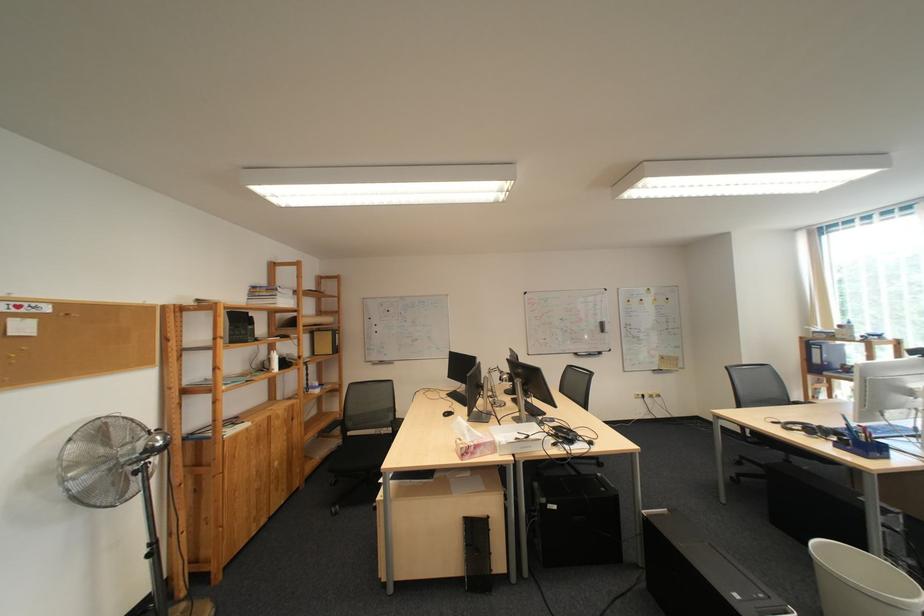
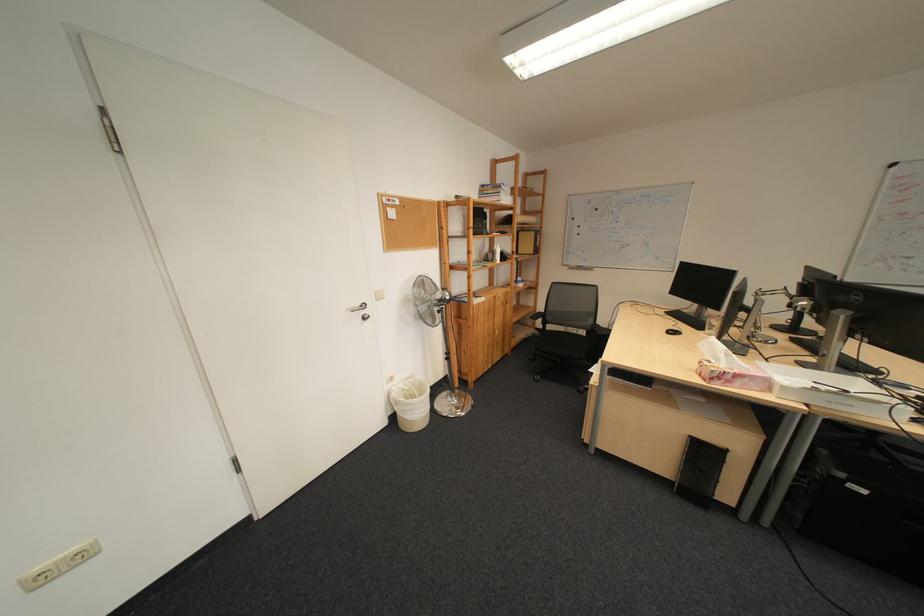
The point at (261, 369) is marked in the first image. Where is the corresponding point in the second image?

(492, 257)